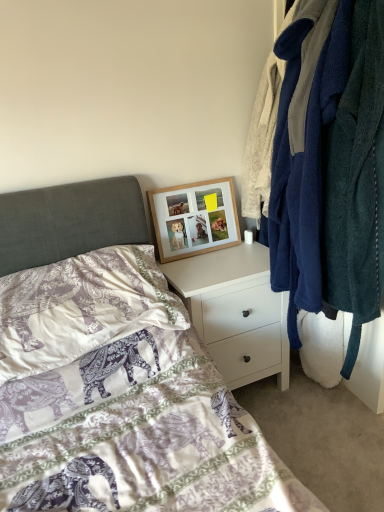
Question: Should I look upward or downward to see woodenobject at upper center?

Choices:
 (A) up
 (B) down

Answer: (A)

Question: Can you confirm if soft fleece robes at right is thinner than purple elephant-patterned pillow at lower left?

Choices:
 (A) yes
 (B) no

Answer: (A)

Question: Is soft fleece robes at right closer to the viewer compared to purple elephant-patterned pillow at lower left?

Choices:
 (A) no
 (B) yes

Answer: (B)

Question: Does soft fleece robes at right turn towards purple elephant-patterned pillow at lower left?

Choices:
 (A) no
 (B) yes

Answer: (B)

Question: From the image's perspective, would you say soft fleece robes at right is positioned over purple elephant-patterned pillow at lower left?

Choices:
 (A) no
 (B) yes

Answer: (B)

Question: Considering the relative sizes of soft fleece robes at right and purple elephant-patterned pillow at lower left in the image provided, is soft fleece robes at right bigger than purple elephant-patterned pillow at lower left?

Choices:
 (A) yes
 (B) no

Answer: (A)

Question: Is soft fleece robes at right far away from purple elephant-patterned pillow at lower left?

Choices:
 (A) yes
 (B) no

Answer: (B)

Question: From a real-world perspective, is purple elephant-patterned pillow at lower left below soft fleece robes at right?

Choices:
 (A) no
 (B) yes

Answer: (B)

Question: Does purple elephant-patterned pillow at lower left have a smaller size compared to soft fleece robes at right?

Choices:
 (A) no
 (B) yes

Answer: (B)

Question: Considering the relative sizes of purple elephant-patterned pillow at lower left and soft fleece robes at right in the image provided, is purple elephant-patterned pillow at lower left taller than soft fleece robes at right?

Choices:
 (A) yes
 (B) no

Answer: (B)

Question: Can you confirm if purple elephant-patterned pillow at lower left is thinner than soft fleece robes at right?

Choices:
 (A) yes
 (B) no

Answer: (B)

Question: Does purple elephant-patterned pillow at lower left contain soft fleece robes at right?

Choices:
 (A) no
 (B) yes

Answer: (A)

Question: Considering the relative positions of purple elephant-patterned pillow at lower left and soft fleece robes at right in the image provided, is purple elephant-patterned pillow at lower left to the left of soft fleece robes at right from the viewer's perspective?

Choices:
 (A) yes
 (B) no

Answer: (A)

Question: Can you confirm if white matte nightstand at upper center is positioned to the left of purple elephant-patterned pillow at lower left?

Choices:
 (A) no
 (B) yes

Answer: (A)